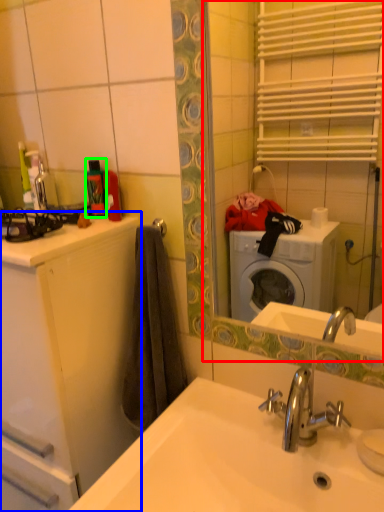
Question: Considering the real-world distances, which object is farthest from mirror (highlighted by a red box)? bathroom cabinet (highlighted by a blue box) or toiletry (highlighted by a green box)?

Choices:
 (A) bathroom cabinet
 (B) toiletry

Answer: (B)